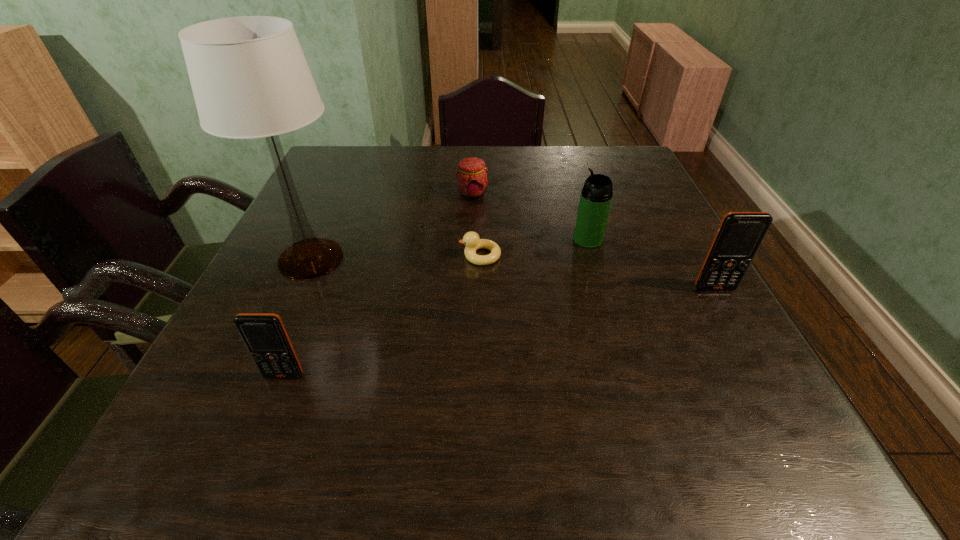
The width and height of the screenshot is (960, 540). I want to click on free space located 0.250m above the cylindrical shade of the tallest object, so click(469, 259).

The image size is (960, 540). What are the coordinates of `vacant region located from the spout of the thermos bottle` in the screenshot? It's located at (535, 239).

Where is `vacant space located from the spout of the thermos bottle`? This screenshot has width=960, height=540. vacant space located from the spout of the thermos bottle is located at coordinates (488, 239).

Where is `vacant space located 0.180m from the spout of the thermos bottle`? vacant space located 0.180m from the spout of the thermos bottle is located at coordinates (496, 239).

Find the location of a particular element. This screenshot has width=960, height=540. vacant region located on the back of the jam is located at coordinates (472, 165).

This screenshot has width=960, height=540. I want to click on vacant space located 0.320m at the beak of the shortest object, so click(x=317, y=256).

I want to click on free space located 0.070m at the beak of the shortest object, so click(x=428, y=256).

Image resolution: width=960 pixels, height=540 pixels. Find the location of `vacant space located at the beak of the shortest object`. vacant space located at the beak of the shortest object is located at coordinates (295, 256).

Image resolution: width=960 pixels, height=540 pixels. Identify the location of object at the near edge. (264, 334).

Image resolution: width=960 pixels, height=540 pixels. I want to click on cellular telephone at the left edge, so click(264, 334).